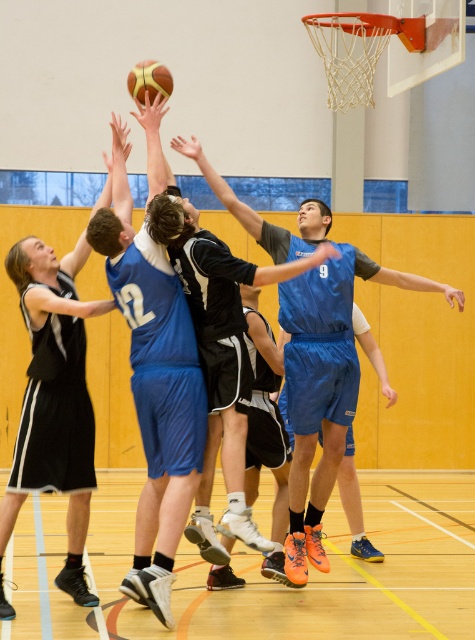
Can you confirm if blue jersey at center is bigger than shiny golden basketball at upper center?

Indeed, blue jersey at center has a larger size compared to shiny golden basketball at upper center.

Between blue jersey at center and shiny golden basketball at upper center, which one appears on the left side from the viewer's perspective?

shiny golden basketball at upper center

You are a GUI agent. You are given a task and a screenshot of the screen. Output one action in this format:
    pyautogui.click(x=<x>, y=<y>)
    Task: Click on the blue jersey at center
    The height and width of the screenshot is (640, 475).
    Given the screenshot: What is the action you would take?
    pyautogui.click(x=218, y=337)

What do you see at coordinates (54, 397) in the screenshot? I see `black jersey at center` at bounding box center [54, 397].

Who is more forward, (47, 401) or (141, 61)?

Point (47, 401) is more forward.

What do you see at coordinates (54, 397) in the screenshot? I see `black jersey at center` at bounding box center [54, 397].

Where is `black jersey at center`? The width and height of the screenshot is (475, 640). black jersey at center is located at coordinates (54, 397).

Between blue matte basketball at center and blue jersey at center, which one appears on the left side from the viewer's perspective?

Positioned to the left is blue matte basketball at center.

Does blue matte basketball at center have a larger size compared to blue jersey at center?

No.

At what (x,y) coordinates should I click in order to perform the action: click on blue matte basketball at center. Please return your answer as a coordinate pair (x, y). Looking at the image, I should click on (154, 387).

The width and height of the screenshot is (475, 640). Find the location of `blue matte basketball at center`. blue matte basketball at center is located at coordinates (154, 387).